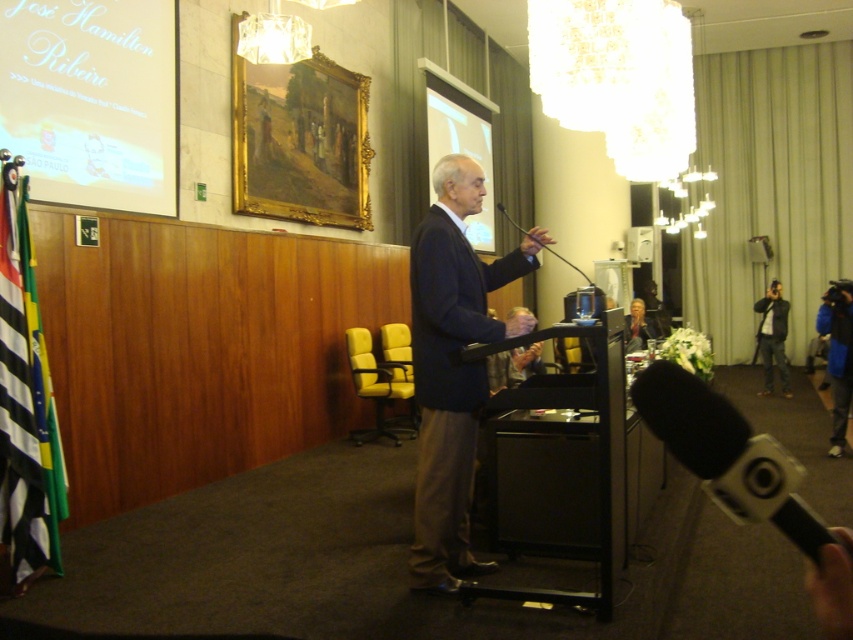
Question: Is dark blue suit at center below black plastic microphone at lower right?

Choices:
 (A) yes
 (B) no

Answer: (A)

Question: Which point is farther from the camera taking this photo?

Choices:
 (A) (575, 268)
 (B) (415, 292)

Answer: (A)

Question: Which point is farther to the camera?

Choices:
 (A) (584, 278)
 (B) (850, 384)
 (C) (766, 336)

Answer: (C)

Question: Is black plastic microphone at lower right smaller than black matte microphone at center?

Choices:
 (A) yes
 (B) no

Answer: (A)

Question: Is gray fabric camera at right further to the viewer compared to black matte microphone at center?

Choices:
 (A) no
 (B) yes

Answer: (B)

Question: Which object appears farthest from the camera in this image?

Choices:
 (A) dark blue suit at center
 (B) black plastic microphone at lower right
 (C) black matte microphone at center

Answer: (C)